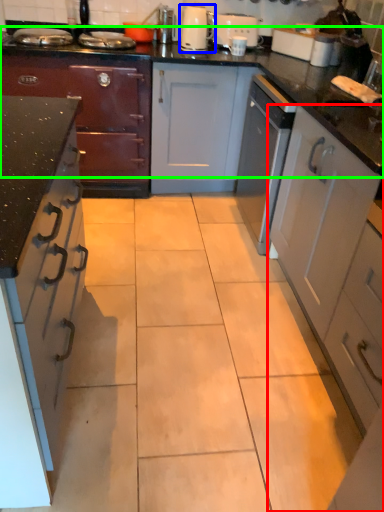
Question: Based on their relative distances, which object is farther from cabinetry (highlighted by a red box)? Choose from kitchen appliance (highlighted by a blue box) and countertop (highlighted by a green box).

Choices:
 (A) kitchen appliance
 (B) countertop

Answer: (A)